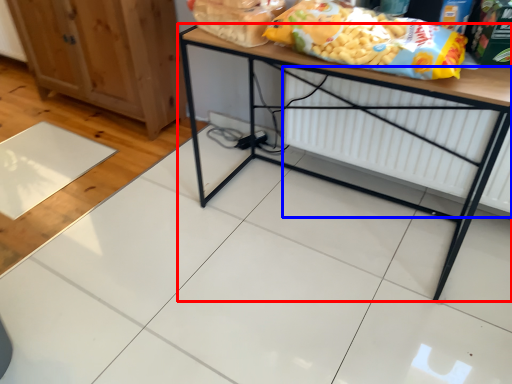
Question: Among these objects, which one is farthest to the camera, table (highlighted by a red box) or radiator (highlighted by a blue box)?

Choices:
 (A) table
 (B) radiator

Answer: (B)